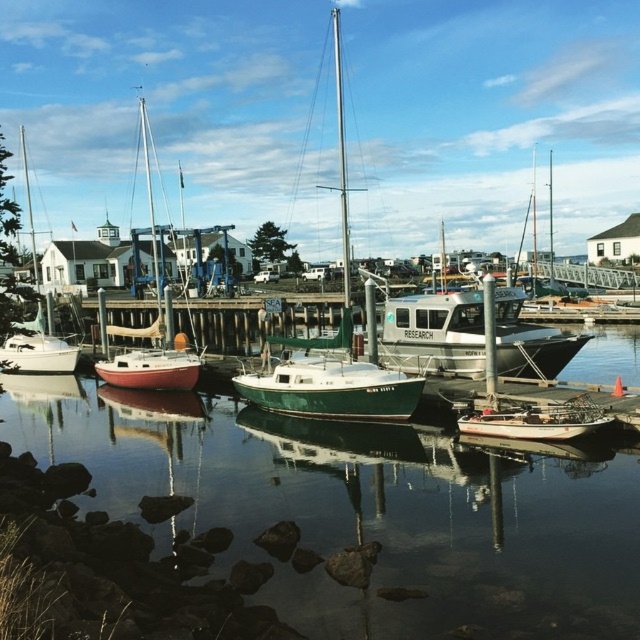
Question: Among these objects, which one is farthest from the camera?

Choices:
 (A) wooden boat at lower right
 (B) green matte sailboat at center
 (C) white matte sailboat at left

Answer: (B)

Question: In this image, where is green matte water at center located relative to white matte sailboat at left?

Choices:
 (A) right
 (B) left

Answer: (A)

Question: Does green matte water at center appear on the right side of wooden boat at lower right?

Choices:
 (A) no
 (B) yes

Answer: (A)

Question: Which of the following is the farthest from the observer?

Choices:
 (A) (561, 408)
 (B) (472, 516)
 (C) (346, 324)
 (D) (12, 364)

Answer: (D)

Question: Does white matte sailboat at left come behind matte white sailboat at center?

Choices:
 (A) no
 (B) yes

Answer: (A)

Question: Which object is farther from the camera taking this photo?

Choices:
 (A) white matte sailboat at left
 (B) matte white sailboat at center
 (C) green matte water at center

Answer: (B)